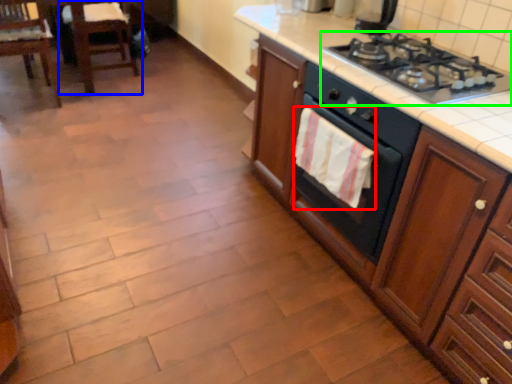
Question: Which object is the closest to the hand towel (highlighted by a red box)? Choose among these: chair (highlighted by a blue box) or gas stove (highlighted by a green box).

Choices:
 (A) chair
 (B) gas stove

Answer: (B)